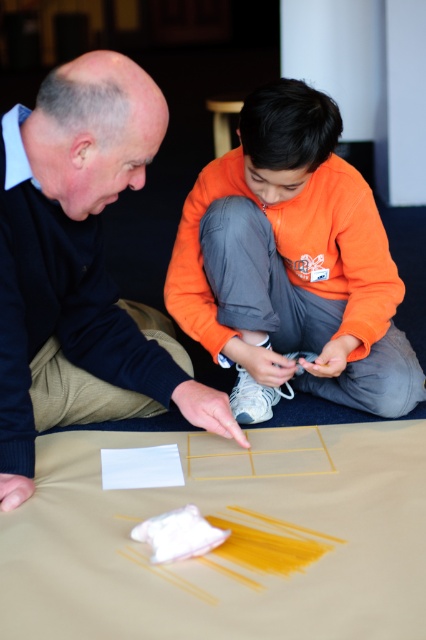
Question: Is matte black sweater at left above orange fabric at center?

Choices:
 (A) yes
 (B) no

Answer: (B)

Question: Which point appears closest to the camera in this image?

Choices:
 (A) (287, 344)
 (B) (25, 467)

Answer: (B)

Question: Can you confirm if matte black sweater at left is positioned below orange fabric at center?

Choices:
 (A) no
 (B) yes

Answer: (B)

Question: Does matte black sweater at left appear over orange fabric at center?

Choices:
 (A) yes
 (B) no

Answer: (B)